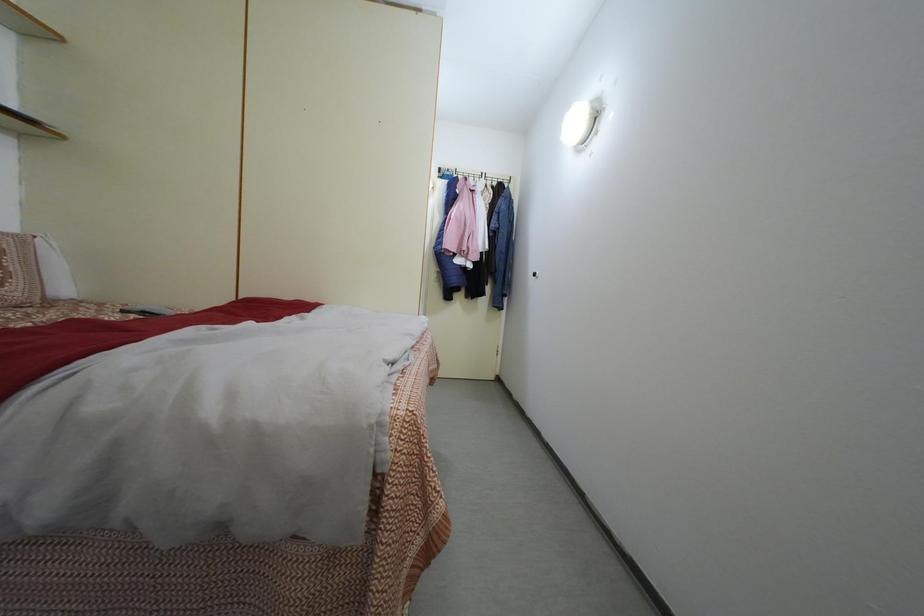
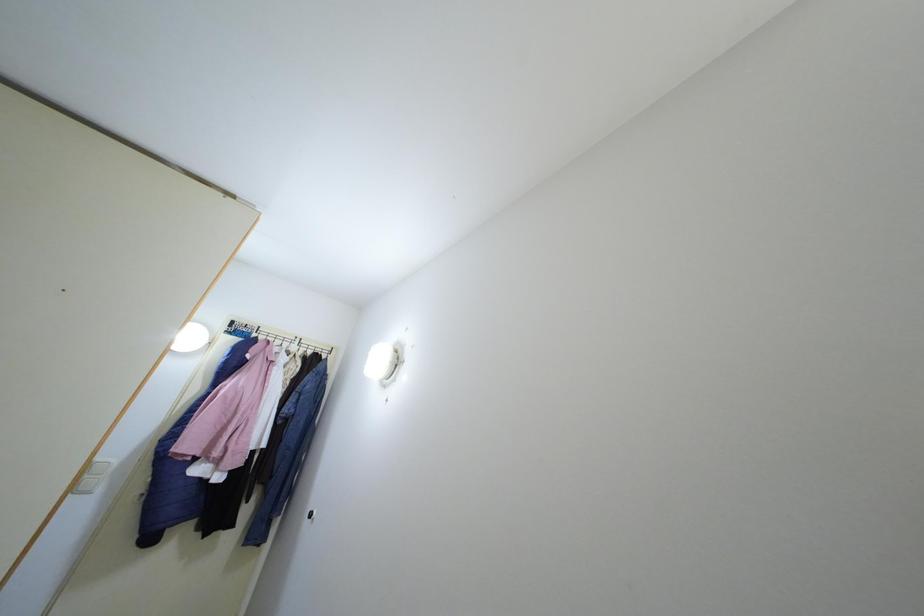
First-person continuous shooting, in which direction is the camera rotating?

The camera rotated toward right-up.